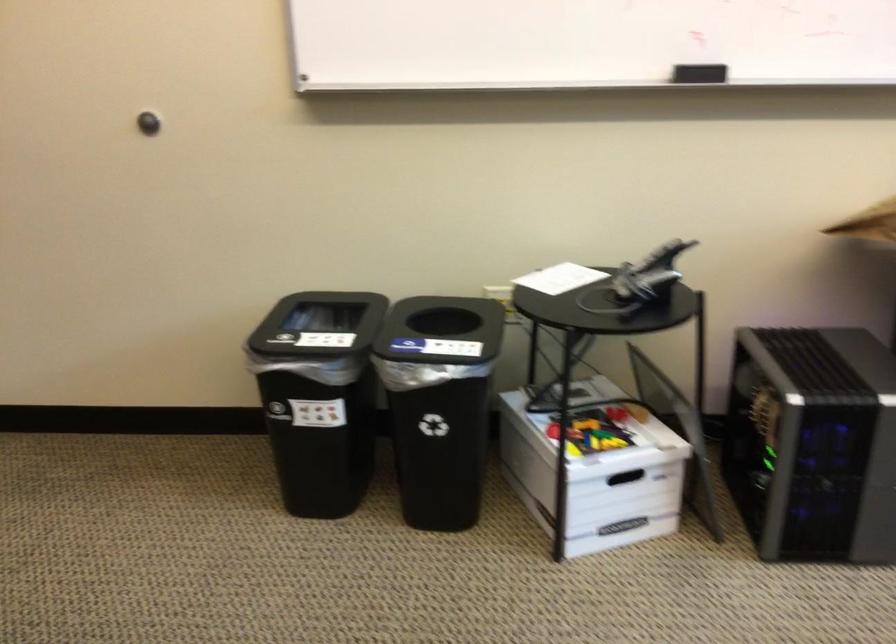
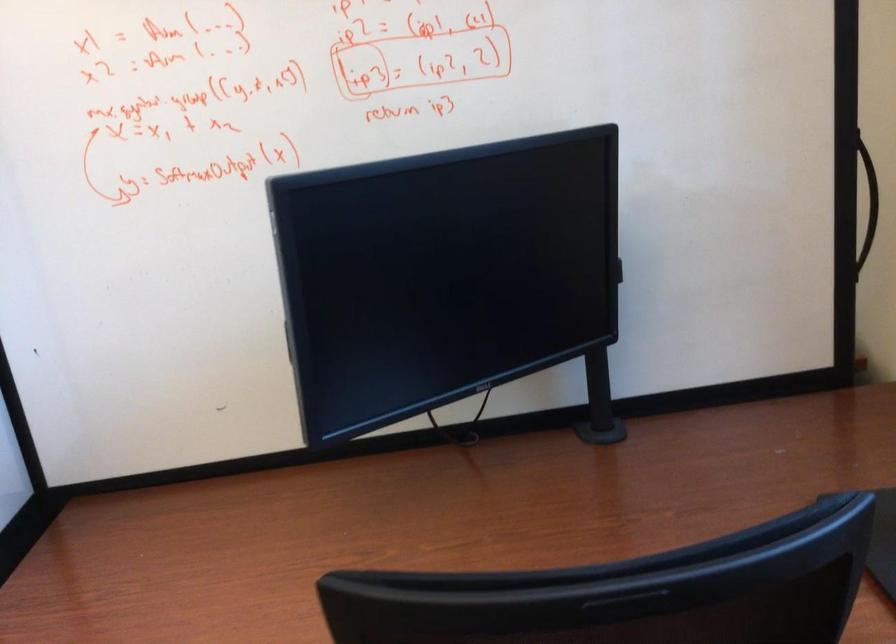
What movement of the cameraman would produce the second image?

The cameraman walked toward right, backward.